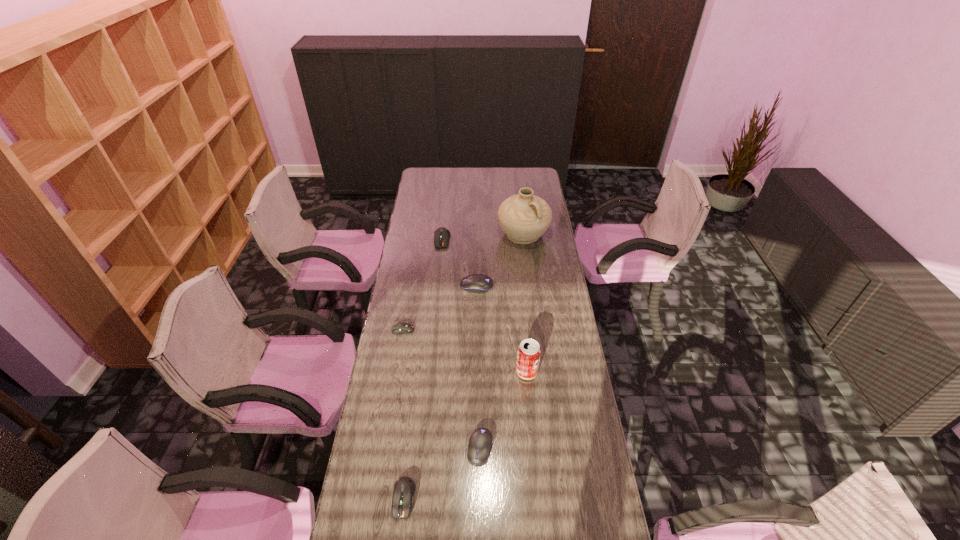
The image size is (960, 540). Identify the location of the smaller black computer mouse. (480, 442).

You are a GUI agent. You are given a task and a screenshot of the screen. Output one action in this format:
    pyautogui.click(x=<x>, y=<y>)
    Task: Click on the smallest dark computer equipment
    The image size is (960, 540).
    Given the screenshot: What is the action you would take?
    coord(400,328)

Locate an element on the screen. The width and height of the screenshot is (960, 540). the leftmost dark computer equipment is located at coordinates (400, 328).

Identify the location of blank space located 0.360m on the left of the tallest object. (426, 235).

At what (x,y) coordinates should I click in order to perform the action: click on vacant space located 0.370m on the left of the fifth farthest object. Please return your answer as a coordinate pair (x, y). The image size is (960, 540). Looking at the image, I should click on [416, 372].

I want to click on vacant region located 0.110m on the button of the farthest computer equipment, so click(440, 264).

Identify the location of free spot located on the back of the farther black computer mouse. (477, 251).

At what (x,y) coordinates should I click in order to perform the action: click on free location located 0.250m on the left of the nearer black computer mouse. Please return your answer as a coordinate pair (x, y). Image resolution: width=960 pixels, height=540 pixels. Looking at the image, I should click on (390, 448).

The height and width of the screenshot is (540, 960). In order to click on free point located 0.300m on the button of the leftmost object in this screenshot , I will do click(x=489, y=330).

Identify the location of pottery that is at the right edge. This screenshot has height=540, width=960. (524, 217).